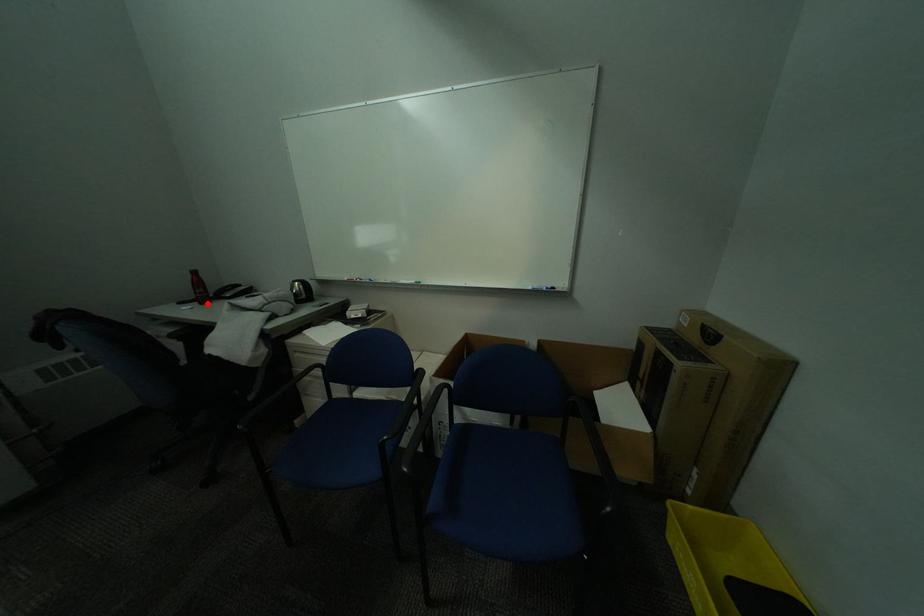
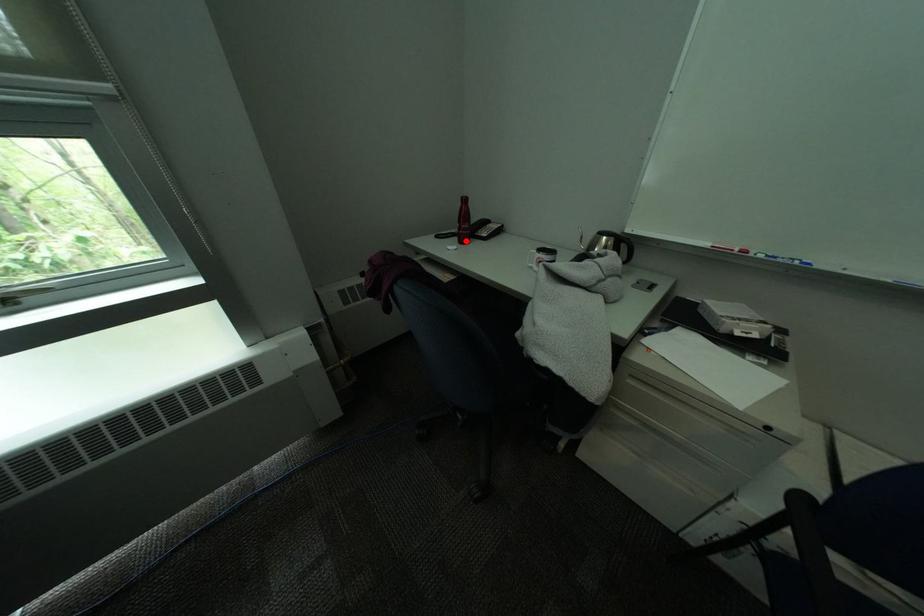
I am providing you with two images of the same scene from different viewpoints. A red point is marked on the first image and another point is marked on the second image. Are the points marked in image1 and image2 representing the same 3D position?

Yes